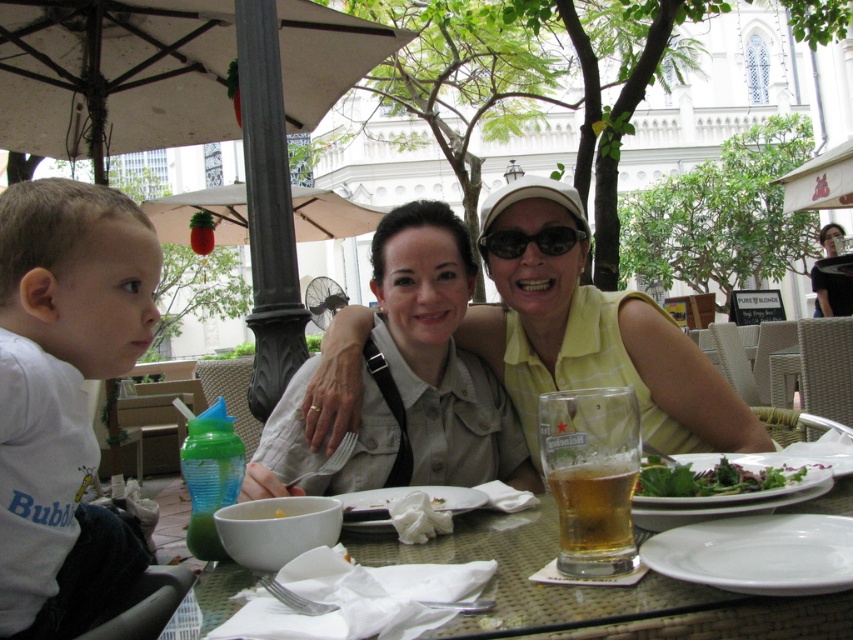
You are a photographer taking a picture of the matte yellow shirt at center and the black plastic sunglasses at center. Which object should you focus on first if you want to capture both clearly in the same frame?

The matte yellow shirt at center has a larger size compared to black plastic sunglasses at center, so you should focus on the matte yellow shirt at center first to ensure both are in focus.